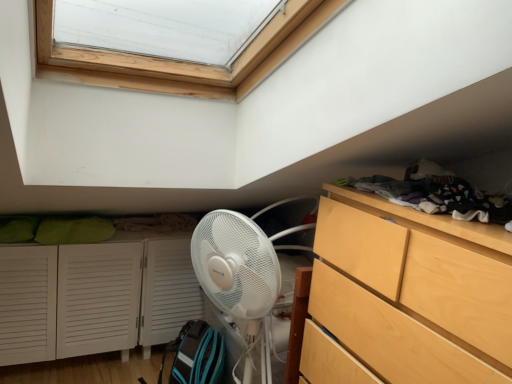
Question: Are light wood/texture chest of drawers at right and white louvered cabinet at lower left far apart?

Choices:
 (A) yes
 (B) no

Answer: (A)

Question: Is light wood/texture chest of drawers at right bigger than white louvered cabinet at lower left?

Choices:
 (A) yes
 (B) no

Answer: (B)

Question: Could you tell me if light wood/texture chest of drawers at right is turned towards white louvered cabinet at lower left?

Choices:
 (A) yes
 (B) no

Answer: (B)

Question: Does light wood/texture chest of drawers at right have a greater height compared to white louvered cabinet at lower left?

Choices:
 (A) no
 (B) yes

Answer: (B)

Question: Is light wood/texture chest of drawers at right at the left side of white louvered cabinet at lower left?

Choices:
 (A) yes
 (B) no

Answer: (B)

Question: From a real-world perspective, relative to light wood/texture chest of drawers at right, is dark gray fabric at upper right vertically above or below?

Choices:
 (A) below
 (B) above

Answer: (B)

Question: Is dark gray fabric at upper right situated inside light wood/texture chest of drawers at right or outside?

Choices:
 (A) inside
 (B) outside

Answer: (B)

Question: From the image's perspective, is dark gray fabric at upper right positioned above or below light wood/texture chest of drawers at right?

Choices:
 (A) above
 (B) below

Answer: (A)

Question: Visually, is dark gray fabric at upper right positioned to the left or to the right of light wood/texture chest of drawers at right?

Choices:
 (A) left
 (B) right

Answer: (B)

Question: Considering the positions of dark gray fabric at upper right and white louvered cabinet at lower left in the image, is dark gray fabric at upper right wider or thinner than white louvered cabinet at lower left?

Choices:
 (A) thin
 (B) wide

Answer: (A)

Question: Based on their positions, is dark gray fabric at upper right located to the left or right of white louvered cabinet at lower left?

Choices:
 (A) left
 (B) right

Answer: (B)

Question: From a real-world perspective, is dark gray fabric at upper right positioned above or below white louvered cabinet at lower left?

Choices:
 (A) above
 (B) below

Answer: (A)

Question: In terms of height, does dark gray fabric at upper right look taller or shorter compared to white louvered cabinet at lower left?

Choices:
 (A) short
 (B) tall

Answer: (A)

Question: From the image's perspective, relative to dark gray fabric at upper right, is light wood/texture chest of drawers at right above or below?

Choices:
 (A) below
 (B) above

Answer: (A)

Question: From their relative heights in the image, would you say light wood/texture chest of drawers at right is taller or shorter than dark gray fabric at upper right?

Choices:
 (A) tall
 (B) short

Answer: (A)